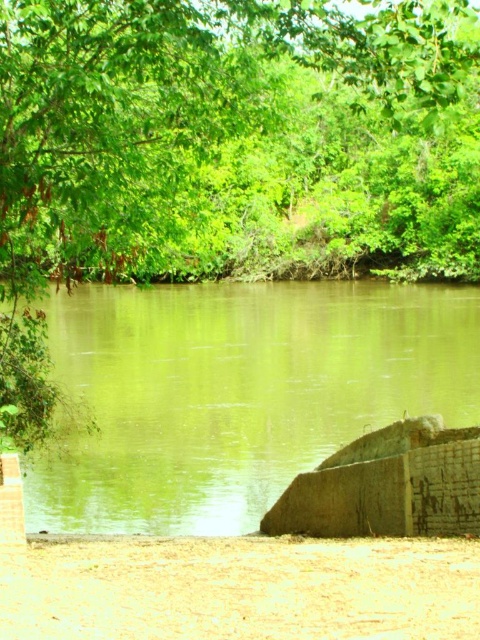
Question: Observing the image, what is the correct spatial positioning of green leafy tree at upper center in reference to greenish-brown water at center?

Choices:
 (A) above
 (B) below

Answer: (A)

Question: Among these points, which one is farthest from the camera?

Choices:
 (A) (403, 10)
 (B) (120, 332)

Answer: (B)

Question: Which object appears farthest from the camera in this image?

Choices:
 (A) green leafy tree at upper center
 (B) greenish-brown water at center

Answer: (B)

Question: Is green leafy tree at upper center smaller than greenish-brown water at center?

Choices:
 (A) yes
 (B) no

Answer: (B)

Question: Can you confirm if green leafy tree at upper center is positioned to the left of greenish-brown water at center?

Choices:
 (A) yes
 (B) no

Answer: (B)